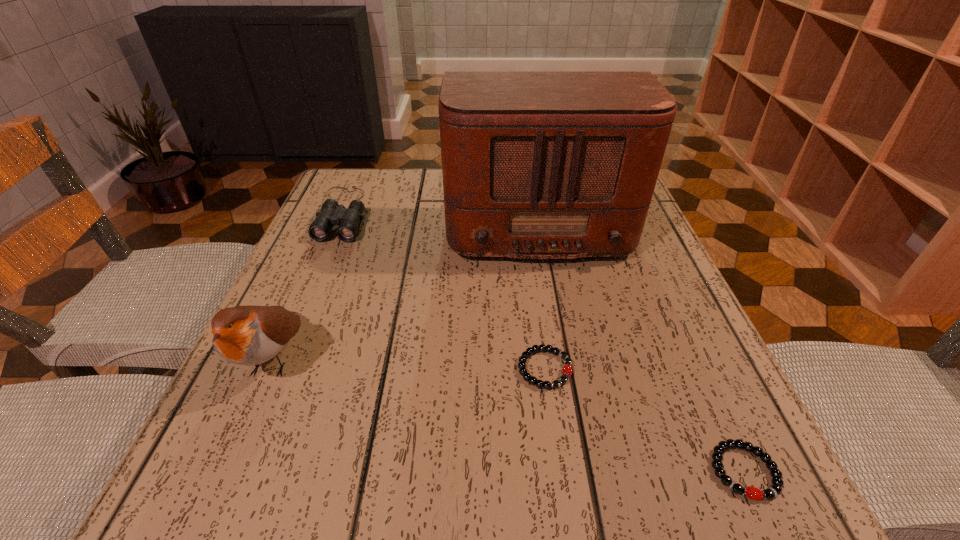
Find the location of a particular element. The width and height of the screenshot is (960, 540). the tallest object is located at coordinates (536, 164).

The height and width of the screenshot is (540, 960). I want to click on bird, so click(248, 335).

Identify the location of binoculars. (331, 213).

Image resolution: width=960 pixels, height=540 pixels. I want to click on the farther bracelet, so click(567, 370).

Find the location of `the nearer bracelet`. the nearer bracelet is located at coordinates (774, 490).

Where is `the nearest object`? The width and height of the screenshot is (960, 540). the nearest object is located at coordinates (774, 490).

At what (x,y) coordinates should I click in order to perform the action: click on free space located on the front panel of the tallest object. Please return your answer as a coordinate pair (x, y). Looking at the image, I should click on (561, 364).

Find the location of a particular element. This screenshot has width=960, height=540. vacant space located at the face of the second tallest object is located at coordinates (237, 442).

Where is `vacant area situated at the eyepiece of the binoculars`? The height and width of the screenshot is (540, 960). vacant area situated at the eyepiece of the binoculars is located at coordinates (279, 364).

In order to click on vacant space located 0.220m on the right of the farther bracelet in this screenshot , I will do `click(713, 369)`.